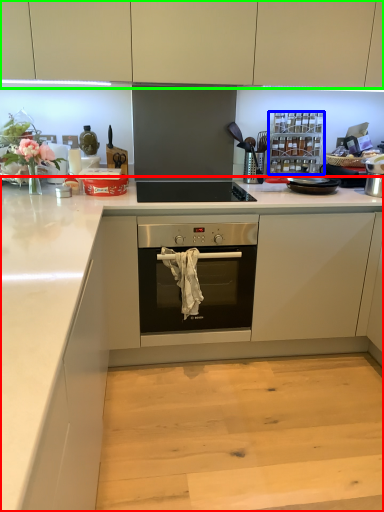
Question: Considering the real-world distances, which object is closest to countertop (highlighted by a red box)? appliance (highlighted by a blue box) or cabinetry (highlighted by a green box).

Choices:
 (A) appliance
 (B) cabinetry

Answer: (A)